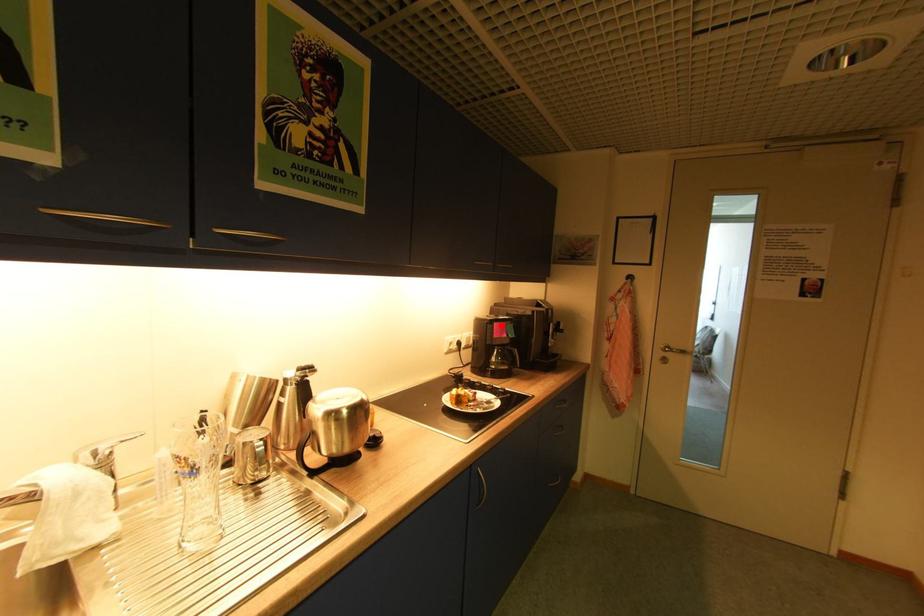
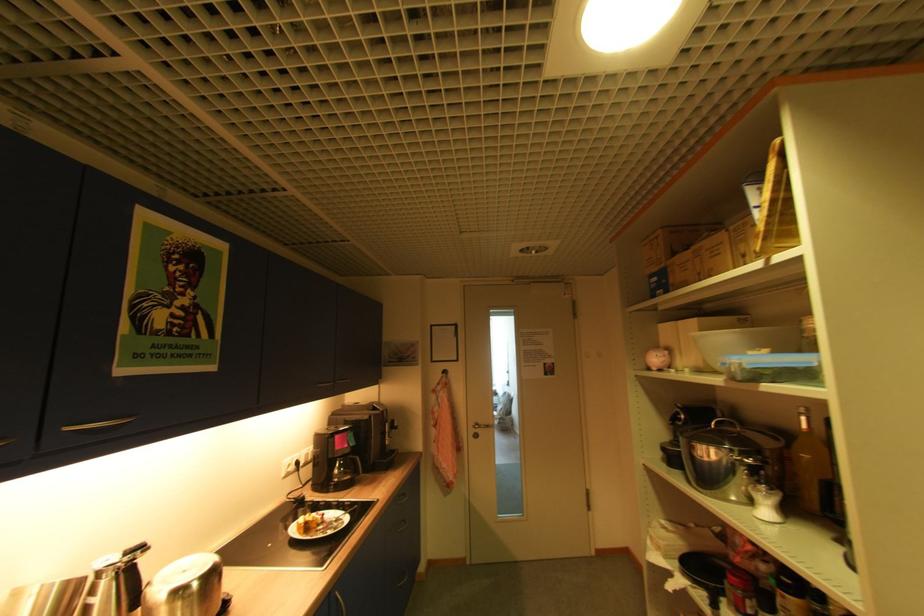
Where in the second image is the point corresponding to the highlighted location from the first image?

(343, 437)